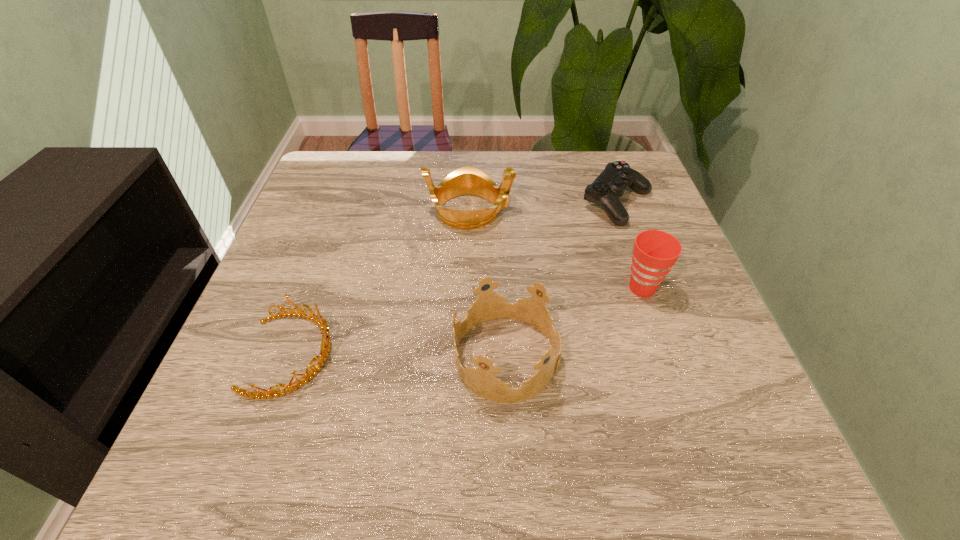
Find the location of a particular element. This screenshot has width=960, height=540. control present at the far edge is located at coordinates (606, 189).

The width and height of the screenshot is (960, 540). I want to click on object present at the left edge, so click(321, 322).

Locate an element on the screen. The image size is (960, 540). cup located at the right edge is located at coordinates (655, 252).

Where is `control that is at the right edge`? control that is at the right edge is located at coordinates (606, 189).

Identify the location of object that is at the far right corner. (606, 189).

This screenshot has width=960, height=540. In the image, there is a desktop. Find the location of `vacant space at the far edge`. vacant space at the far edge is located at coordinates (504, 157).

The width and height of the screenshot is (960, 540). I want to click on vacant space at the near edge, so click(x=305, y=458).

Find the location of `free space at the left edge of the desktop`. free space at the left edge of the desktop is located at coordinates (241, 412).

The image size is (960, 540). I want to click on free region at the right edge of the desktop, so click(671, 418).

Locate an element on the screen. vacant point at the far left corner is located at coordinates (356, 165).